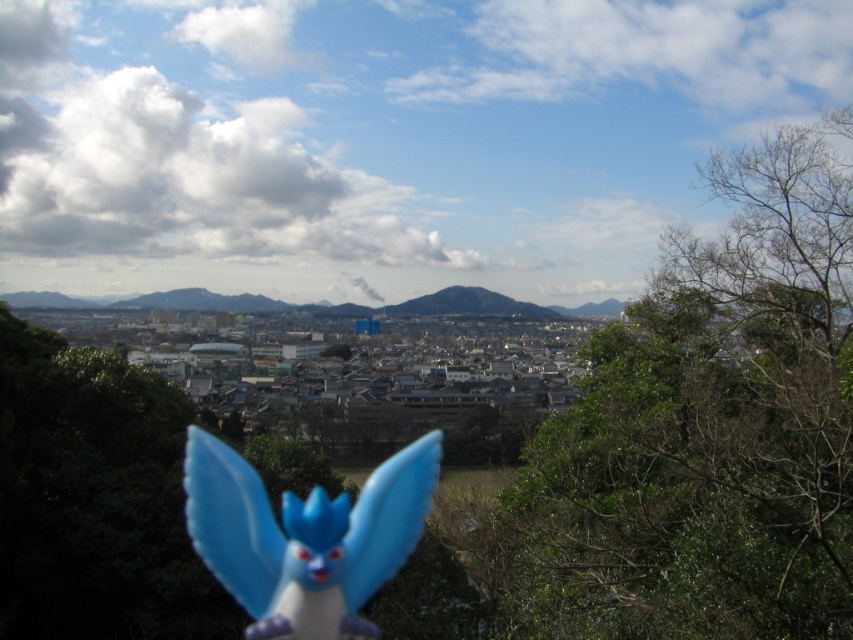
Between green leafy tree at center right and blue plastic toy at center, which one appears on the left side from the viewer's perspective?

Positioned to the left is blue plastic toy at center.

Between point (582, 564) and point (296, 529), which one is positioned behind?

Point (296, 529)

Locate an element on the screen. The width and height of the screenshot is (853, 640). green leafy tree at center right is located at coordinates (708, 428).